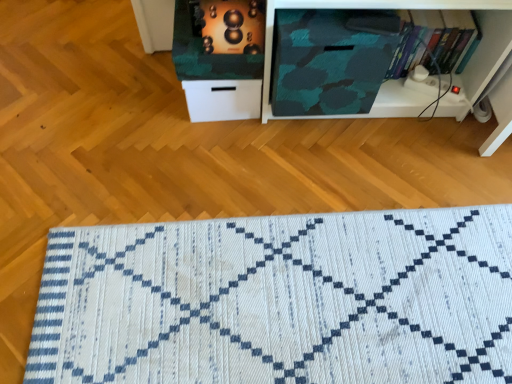
Question: Considering the relative positions of hardcover book at upper right and white woven mat at lower center in the image provided, is hardcover book at upper right to the left of white woven mat at lower center from the viewer's perspective?

Choices:
 (A) yes
 (B) no

Answer: (B)

Question: Does hardcover book at upper right turn towards white woven mat at lower center?

Choices:
 (A) yes
 (B) no

Answer: (B)

Question: Is hardcover book at upper right positioned far away from white woven mat at lower center?

Choices:
 (A) no
 (B) yes

Answer: (A)

Question: Considering the relative sizes of hardcover book at upper right and white woven mat at lower center in the image provided, is hardcover book at upper right shorter than white woven mat at lower center?

Choices:
 (A) yes
 (B) no

Answer: (B)

Question: Is hardcover book at upper right not within white woven mat at lower center?

Choices:
 (A) no
 (B) yes

Answer: (B)

Question: Do you think camouflage fabric cabinet at center is within camouflage fabric at center, or outside of it?

Choices:
 (A) inside
 (B) outside

Answer: (B)

Question: Considering the positions of camouflage fabric cabinet at center and camouflage fabric at center in the image, is camouflage fabric cabinet at center bigger or smaller than camouflage fabric at center?

Choices:
 (A) small
 (B) big

Answer: (B)

Question: In the image, is camouflage fabric cabinet at center positioned in front of or behind camouflage fabric at center?

Choices:
 (A) behind
 (B) front

Answer: (A)

Question: Would you say camouflage fabric cabinet at center is to the left or to the right of camouflage fabric at center in the picture?

Choices:
 (A) right
 (B) left

Answer: (B)

Question: From a real-world perspective, relative to metallic gold speaker at upper center, is camouflage fabric at center vertically above or below?

Choices:
 (A) below
 (B) above

Answer: (A)

Question: Considering the positions of camouflage fabric at center and metallic gold speaker at upper center in the image, is camouflage fabric at center wider or thinner than metallic gold speaker at upper center?

Choices:
 (A) thin
 (B) wide

Answer: (B)

Question: From the image's perspective, relative to metallic gold speaker at upper center, is camouflage fabric at center above or below?

Choices:
 (A) below
 (B) above

Answer: (A)

Question: In the image, is camouflage fabric at center positioned in front of or behind metallic gold speaker at upper center?

Choices:
 (A) front
 (B) behind

Answer: (B)

Question: Do you think hardcover book at upper right is within metallic gold speaker at upper center, or outside of it?

Choices:
 (A) inside
 (B) outside

Answer: (B)

Question: Considering the positions of hardcover book at upper right and metallic gold speaker at upper center in the image, is hardcover book at upper right bigger or smaller than metallic gold speaker at upper center?

Choices:
 (A) big
 (B) small

Answer: (A)